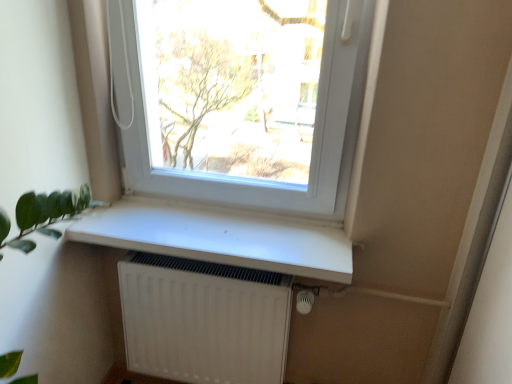
Question: Is white matte radiator at lower center at the right side of white plastic window at upper center?

Choices:
 (A) yes
 (B) no

Answer: (B)

Question: Considering the relative sizes of white matte radiator at lower center and white plastic window at upper center in the image provided, is white matte radiator at lower center shorter than white plastic window at upper center?

Choices:
 (A) yes
 (B) no

Answer: (A)

Question: Is white matte radiator at lower center touching white plastic window at upper center?

Choices:
 (A) no
 (B) yes

Answer: (A)

Question: Can white plastic window at upper center be found inside white matte radiator at lower center?

Choices:
 (A) no
 (B) yes

Answer: (A)

Question: Considering the relative sizes of white matte radiator at lower center and white plastic window at upper center in the image provided, is white matte radiator at lower center bigger than white plastic window at upper center?

Choices:
 (A) yes
 (B) no

Answer: (B)

Question: Is the position of white matte radiator at lower center less distant than that of white plastic window at upper center?

Choices:
 (A) yes
 (B) no

Answer: (B)

Question: From the image's perspective, would you say white matte window sill at center is positioned over white matte radiator at lower center?

Choices:
 (A) no
 (B) yes

Answer: (B)

Question: Is white matte window sill at center next to white matte radiator at lower center and touching it?

Choices:
 (A) no
 (B) yes

Answer: (A)

Question: From a real-world perspective, is white matte window sill at center beneath white matte radiator at lower center?

Choices:
 (A) no
 (B) yes

Answer: (A)

Question: Is white matte window sill at center closer to camera compared to white matte radiator at lower center?

Choices:
 (A) no
 (B) yes

Answer: (B)

Question: Considering the relative sizes of white matte window sill at center and white matte radiator at lower center in the image provided, is white matte window sill at center shorter than white matte radiator at lower center?

Choices:
 (A) yes
 (B) no

Answer: (A)

Question: Is white matte window sill at center smaller than white matte radiator at lower center?

Choices:
 (A) no
 (B) yes

Answer: (B)

Question: Does white plastic window at upper center lie in front of white matte window sill at center?

Choices:
 (A) yes
 (B) no

Answer: (A)